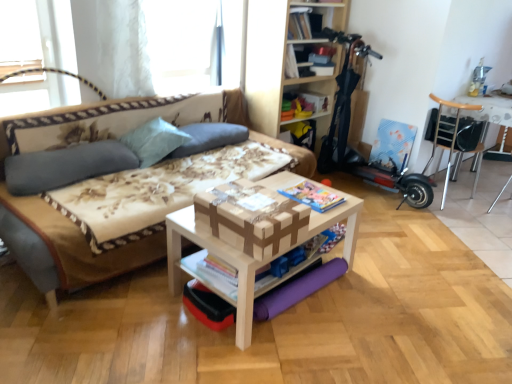
Question: From a real-world perspective, is brown cardboard box at center physically located above or below light blue fabric pillow at upper left, the second pillow in the right-to-left sequence?

Choices:
 (A) above
 (B) below

Answer: (B)

Question: From the image's perspective, is brown cardboard box at center located above or below light blue fabric pillow at upper left, the second pillow in the right-to-left sequence?

Choices:
 (A) above
 (B) below

Answer: (B)

Question: Which object is the farthest from the matte paper magazine at center, the 1th magazine positioned from the bottom?

Choices:
 (A) wooden bookshelf at upper center
 (B) beige fabric couch at left
 (C) metallic silver chair at upper right, placed as the 1th table when sorted from back to front
 (D) wooden bookshelf at upper center
 (E) white wood table at center, the second table from the right

Answer: (C)

Question: Estimate the real-world distances between objects in this image. Which object is closer to the light blue fabric pillow at upper left, the second pillow in the right-to-left sequence?

Choices:
 (A) metallic silver chair at upper right, positioned as the 2th table in front-to-back order
 (B) matte paper magazine at center, the 2th magazine from the left
 (C) matte paper magazine at center, the 2th magazine positioned from the top
 (D) matte cardboard storage box at upper center
 (E) wooden bookshelf at upper center

Answer: (C)